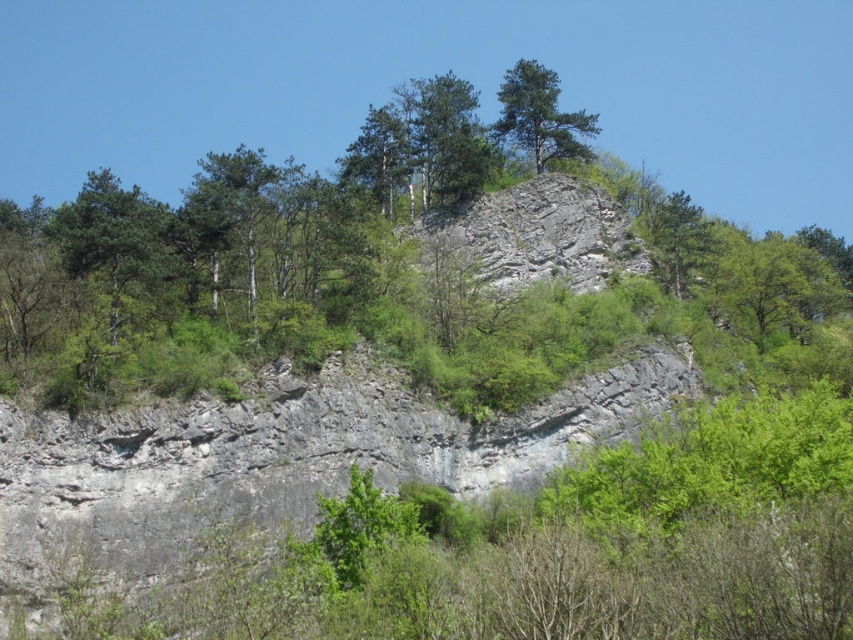
You are a hiker trying to navigate the cliff area. You see the green matte tree at upper left and the green matte tree at upper center. Which tree is positioned further to the left side of the cliff?

The green matte tree at upper left is positioned further to the left side of the cliff compared to the green matte tree at upper center.

You are a hiker trying to navigate the cliff. You see the green matte tree at upper left and the green matte tree at upper center. Which tree is positioned lower on the cliff?

The green matte tree at upper left is located below the green matte tree at upper center, so it is positioned lower on the cliff.